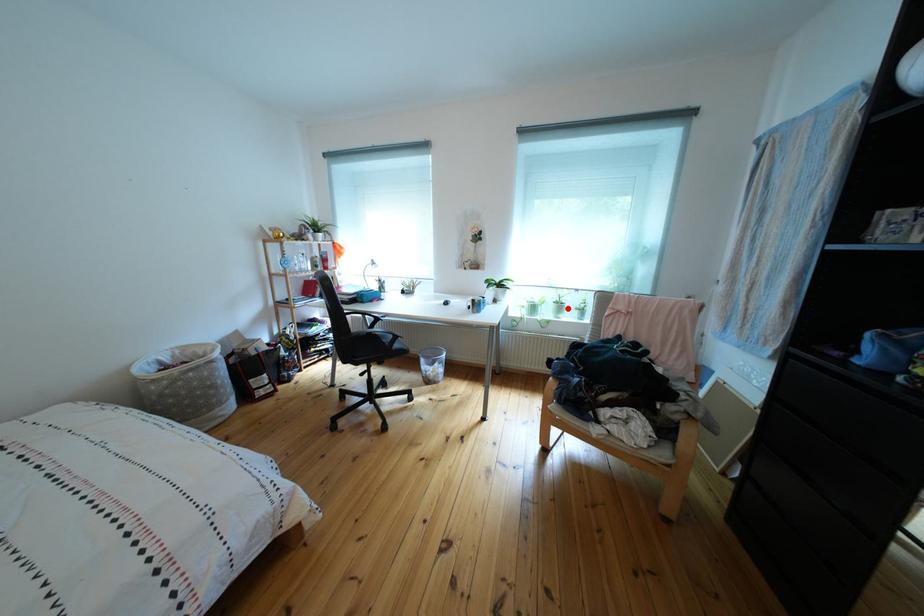
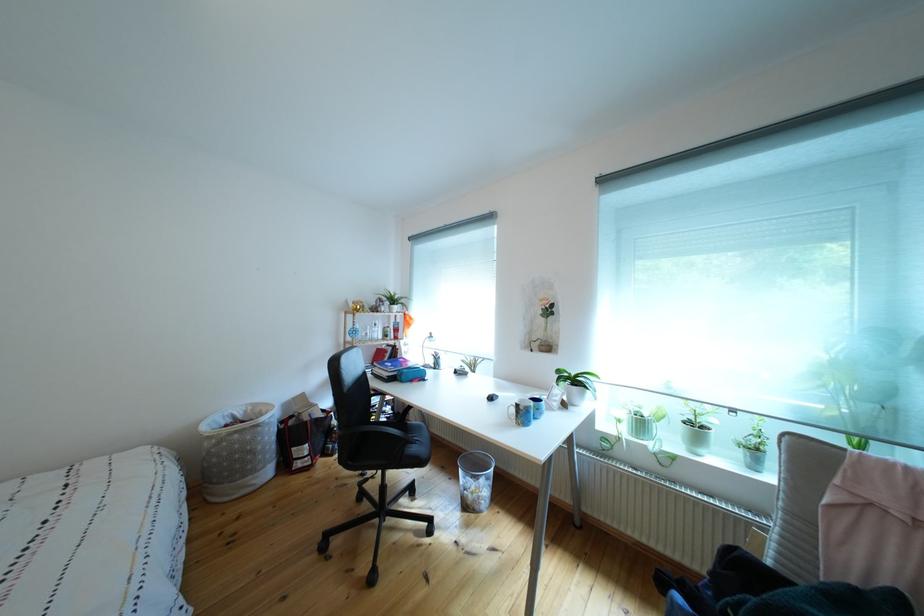
Locate, in the second image, the point that corresponds to the highlighted location in the first image.

(699, 429)